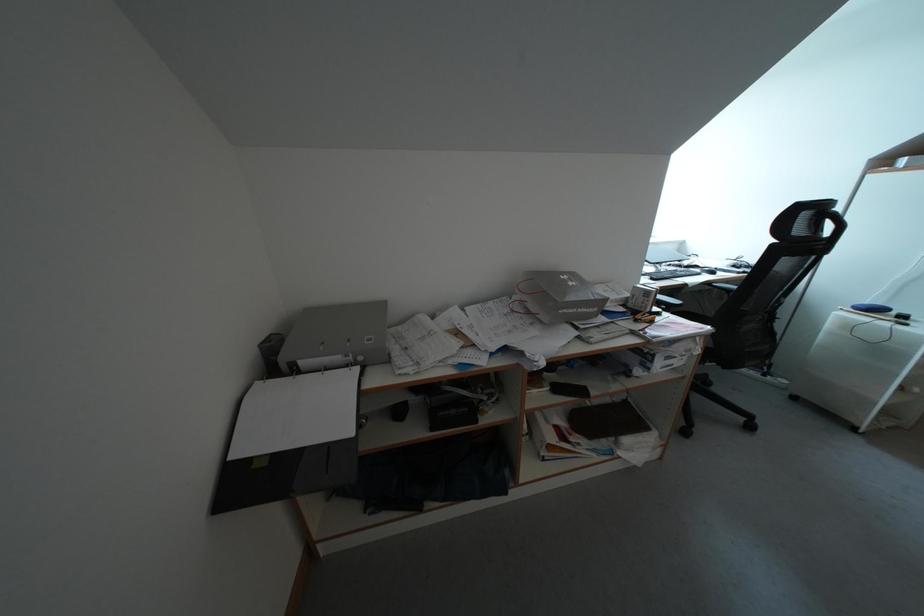
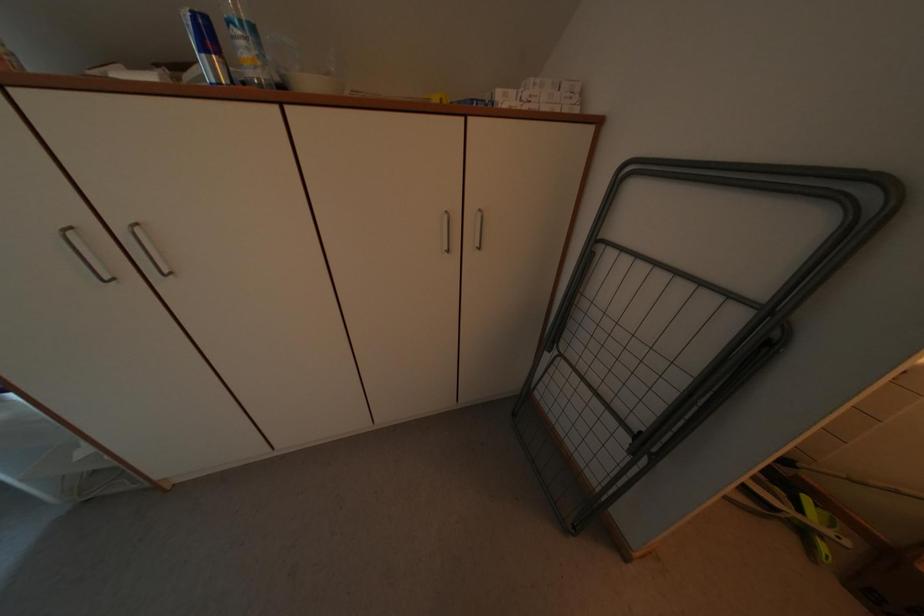
Question: What movement of the cameraman would produce the second image?

Choices:
 (A) Left
 (B) Right
 (C) Forward
 (D) Backward

Answer: (B)